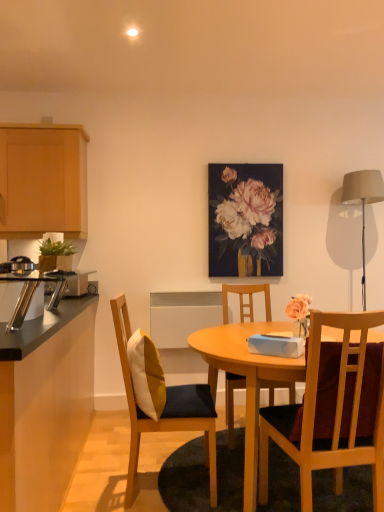
Question: Which direction should I rotate to face wooden chair with cushion at center, acting as the 3th chair starting from the right, — up or down?

Choices:
 (A) down
 (B) up

Answer: (A)

Question: Does white/yellow fabric pillow at center-left appear on the left side of satin silver toaster at left, placed as the 1th appliance when sorted from left to right?

Choices:
 (A) no
 (B) yes

Answer: (A)

Question: Does white/yellow fabric pillow at center-left appear on the right side of satin silver toaster at left, arranged as the first appliance when viewed from the back?

Choices:
 (A) yes
 (B) no

Answer: (A)

Question: Can we say white/yellow fabric pillow at center-left lies outside satin silver toaster at left, which is counted as the 2th appliance, starting from the front?

Choices:
 (A) yes
 (B) no

Answer: (A)

Question: Is white/yellow fabric pillow at center-left behind satin silver toaster at left, arranged as the first appliance when viewed from the back?

Choices:
 (A) yes
 (B) no

Answer: (B)

Question: From the image's perspective, is white/yellow fabric pillow at center-left over satin silver toaster at left, which is counted as the 2th appliance, starting from the front?

Choices:
 (A) no
 (B) yes

Answer: (A)

Question: Considering the relative sizes of white/yellow fabric pillow at center-left and satin silver toaster at left, which is counted as the 2th appliance, starting from the front, in the image provided, is white/yellow fabric pillow at center-left smaller than satin silver toaster at left, which is counted as the 2th appliance, starting from the front,?

Choices:
 (A) yes
 (B) no

Answer: (B)

Question: From a real-world perspective, is wooden chair at center, which is counted as the 3th chair, starting from the back, located higher than matte gray lampshade at right?

Choices:
 (A) no
 (B) yes

Answer: (A)

Question: Does wooden chair at center, the 1th chair in the right-to-left sequence, have a lesser width compared to matte gray lampshade at right?

Choices:
 (A) no
 (B) yes

Answer: (A)

Question: Is wooden chair at center, placed as the first chair when sorted from front to back, outside matte gray lampshade at right?

Choices:
 (A) no
 (B) yes

Answer: (B)

Question: Considering the relative positions of wooden chair at center, which is counted as the 3th chair, starting from the back, and matte gray lampshade at right in the image provided, is wooden chair at center, which is counted as the 3th chair, starting from the back, behind matte gray lampshade at right?

Choices:
 (A) yes
 (B) no

Answer: (B)

Question: From the image's perspective, is wooden chair at center, which is counted as the 3th chair, starting from the back, located above matte gray lampshade at right?

Choices:
 (A) yes
 (B) no

Answer: (B)

Question: Is wooden chair at center, which is counted as the 3th chair, starting from the back, shorter than matte gray lampshade at right?

Choices:
 (A) yes
 (B) no

Answer: (A)

Question: Is metallic silver toaster at left, acting as the 1th appliance starting from the right, shorter than light wood cabinet at upper left, the 1th cabinetry from the top?

Choices:
 (A) no
 (B) yes

Answer: (B)